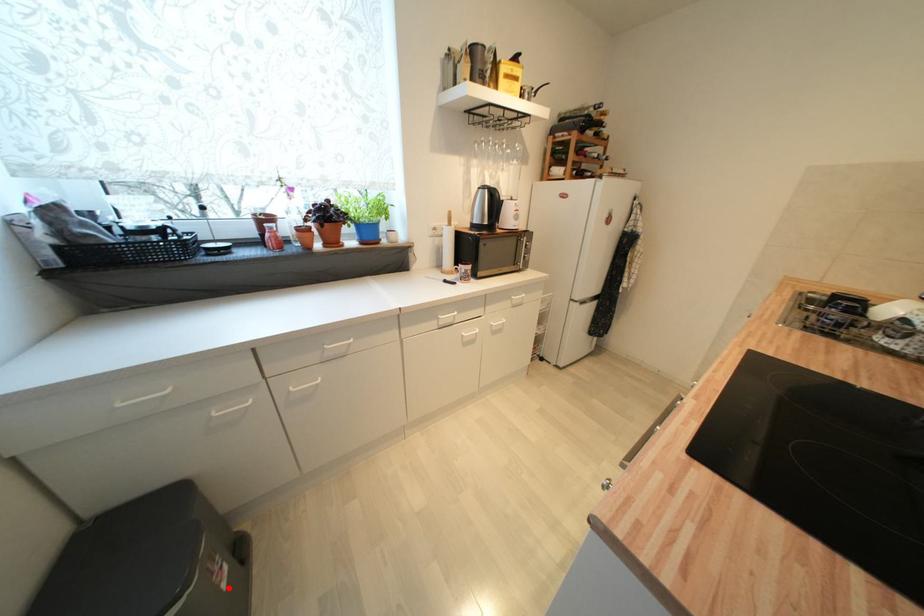
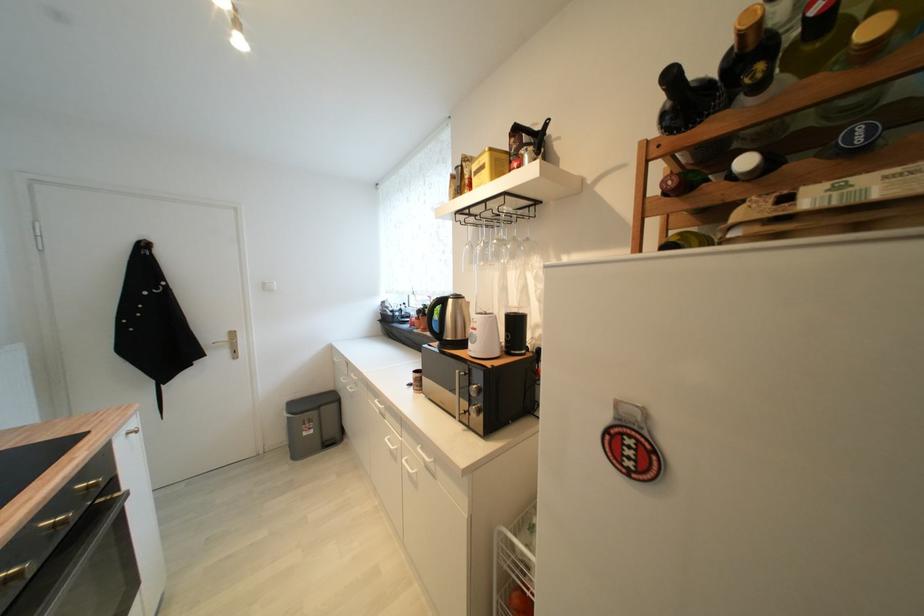
The point at the highlighted location is marked in the first image. Where is the corresponding point in the second image?

(310, 436)